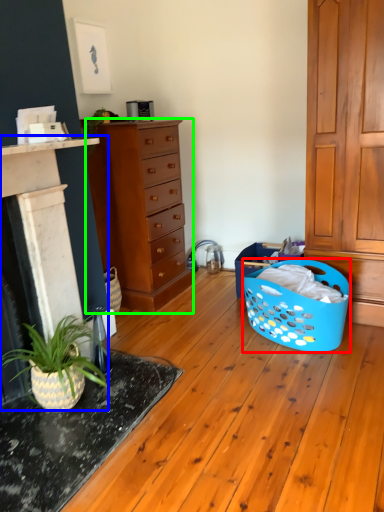
Question: Which object is the farthest from basket (highlighted by a red box)? Choose among these: fireplace (highlighted by a blue box) or chest of drawers (highlighted by a green box).

Choices:
 (A) fireplace
 (B) chest of drawers

Answer: (A)